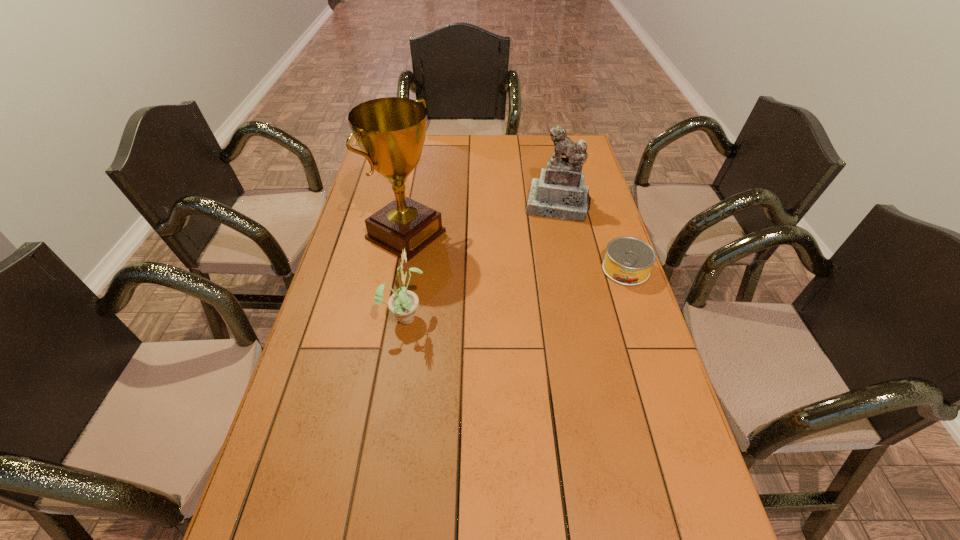
At what (x,y) coordinates should I click in order to perform the action: click on sunflower. Please return your answer as a coordinate pair (x, y). The image size is (960, 540). Looking at the image, I should click on (403, 304).

The width and height of the screenshot is (960, 540). I want to click on the nearest object, so click(x=403, y=304).

Where is `the shortest object`? This screenshot has width=960, height=540. the shortest object is located at coordinates (628, 261).

Locate an element on the screen. The height and width of the screenshot is (540, 960). award is located at coordinates (390, 131).

I want to click on the second tallest object, so click(x=560, y=193).

Locate an element on the screen. blank area located on the front-facing side of the sunflower is located at coordinates (483, 316).

Locate an element on the screen. The image size is (960, 540). free space located on the back of the shortest object is located at coordinates (611, 225).

The height and width of the screenshot is (540, 960). Find the location of `vacant space located on the plaque of the tallest object`. vacant space located on the plaque of the tallest object is located at coordinates (535, 302).

Identify the location of vacant space positioned on the plaque of the tallest object. The image size is (960, 540). (516, 293).

At what (x,y) coordinates should I click in order to perform the action: click on free location located 0.090m on the plaque of the tallest object. Please return your answer as a coordinate pair (x, y). Looking at the image, I should click on (458, 262).